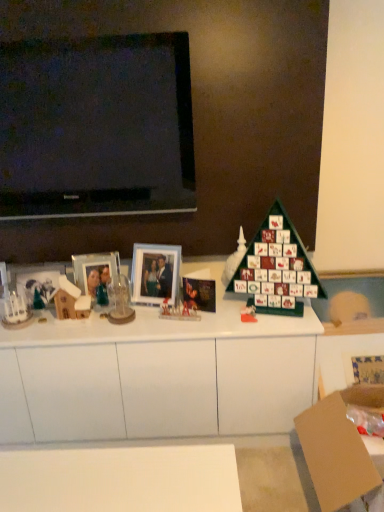
Locate an element on the screen. free space in front of green matte advent calendar at center, marked as the fourth toy in a left-to-right arrangement is located at coordinates (253, 328).